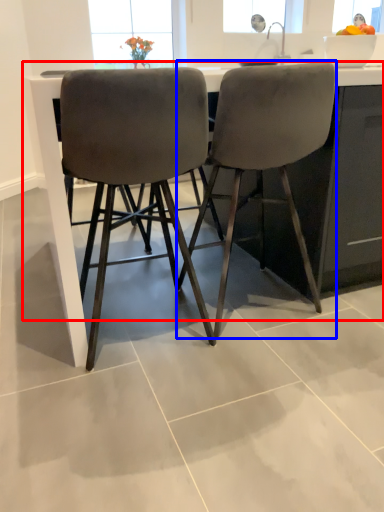
Question: Which of the following is the farthest to the observer, counter (highlighted by a red box) or chair (highlighted by a blue box)?

Choices:
 (A) counter
 (B) chair

Answer: (B)